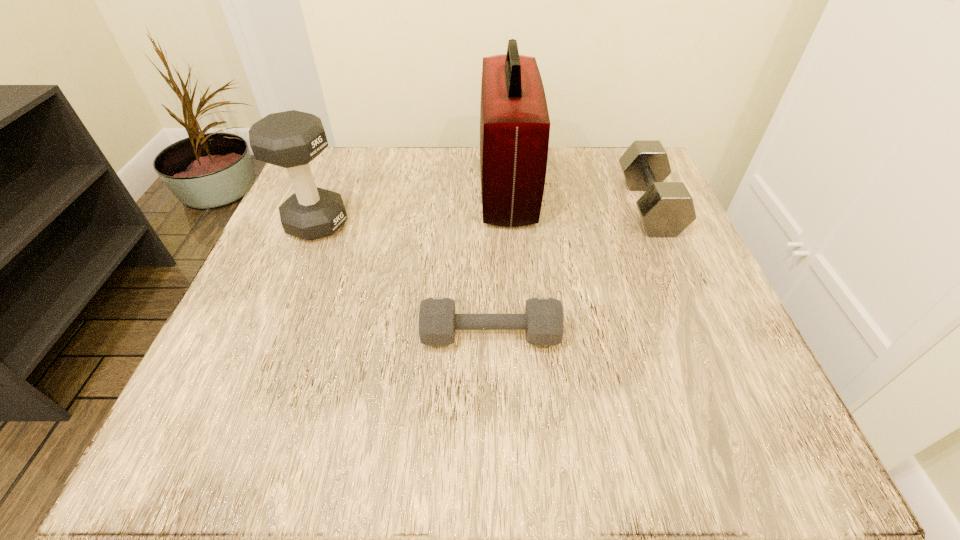
Identify the location of free spot that satisfies the following two spatial constraints: 1. on the front side of the nearest object; 2. on the left side of the leftmost object. This screenshot has width=960, height=540. (272, 335).